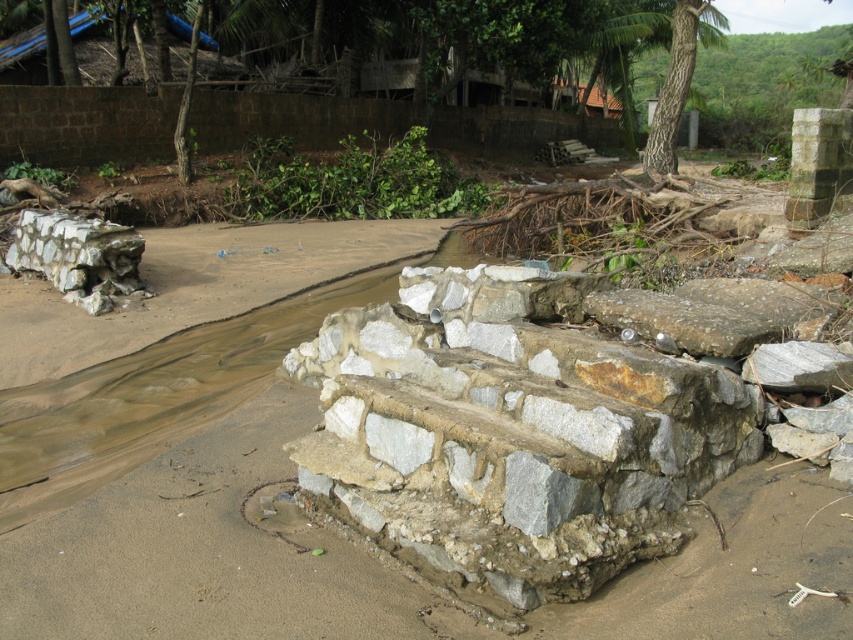
Question: Considering the relative positions of brown sandy dirt track at center and gray stone wall at left in the image provided, where is brown sandy dirt track at center located with respect to gray stone wall at left?

Choices:
 (A) left
 (B) right

Answer: (B)

Question: From the image, what is the correct spatial relationship of gray stone steps at center in relation to brown sandy dirt track at center?

Choices:
 (A) right
 (B) left

Answer: (A)

Question: Does gray stone steps at center have a greater width compared to gray stone wall at left?

Choices:
 (A) yes
 (B) no

Answer: (A)

Question: Which object appears farthest from the camera in this image?

Choices:
 (A) brown sandy dirt track at center
 (B) gray stone steps at center

Answer: (A)

Question: Which of the following is the farthest from the observer?

Choices:
 (A) brown sandy dirt track at center
 (B) gray stone wall at left

Answer: (B)

Question: Estimate the real-world distances between objects in this image. Which object is closer to the gray stone steps at center?

Choices:
 (A) gray stone wall at left
 (B) brown sandy dirt track at center

Answer: (B)